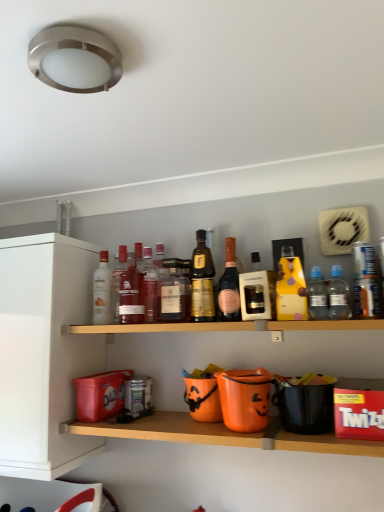
This screenshot has height=512, width=384. I want to click on free location to the left of clear plastic bottle at center right, which appears as the 8th bottle when viewed from the left, so click(x=279, y=315).